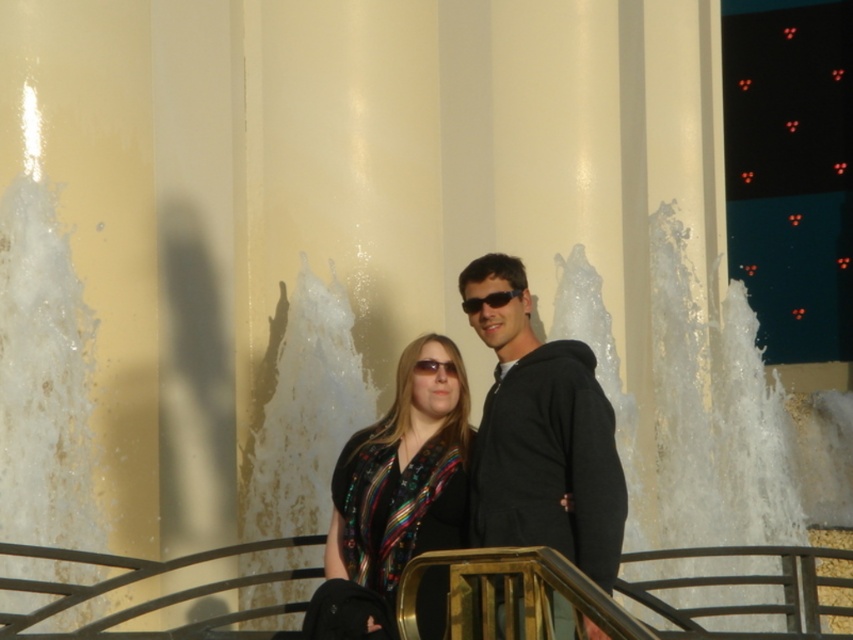
Question: Does multicolored fabric blouse at center appear over black plastic sunglasses at center?

Choices:
 (A) no
 (B) yes

Answer: (A)

Question: Among these objects, which one is farthest from the camera?

Choices:
 (A) black plastic sunglasses at center
 (B) multicolored fabric blouse at center

Answer: (A)

Question: Estimate the real-world distances between objects in this image. Which object is farther from the black matte hoodie at center?

Choices:
 (A) black plastic sunglasses at center
 (B) multicolored fabric blouse at center

Answer: (A)

Question: Does black matte hoodie at center have a lesser width compared to black plastic sunglasses at center?

Choices:
 (A) no
 (B) yes

Answer: (A)

Question: Which is farther from the black matte hoodie at center?

Choices:
 (A) black plastic sunglasses at center
 (B) multicolored fabric blouse at center

Answer: (A)

Question: Does black matte hoodie at center have a greater width compared to black plastic sunglasses at center?

Choices:
 (A) no
 (B) yes

Answer: (B)